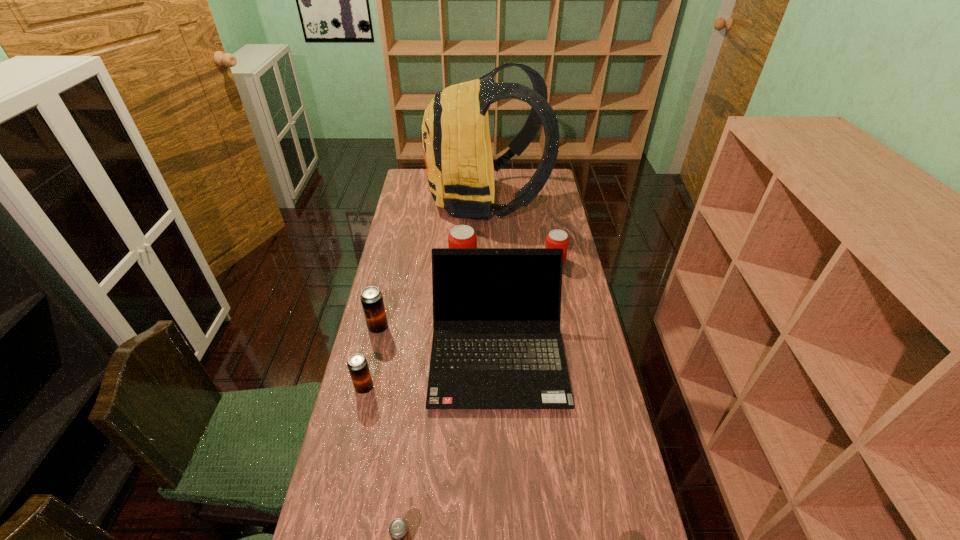
Identify the location of backpack situated at the left edge. (460, 168).

Where is `backpack that is at the right edge`? backpack that is at the right edge is located at coordinates (460, 168).

Identify the location of laptop computer that is positioned at the right edge. (497, 344).

Locate an element on the screen. beer can positioned at the right edge is located at coordinates (x=556, y=238).

The image size is (960, 540). Identify the location of object present at the far left corner. (460, 168).

Where is `object located at the far right corner`? This screenshot has height=540, width=960. object located at the far right corner is located at coordinates (460, 168).

Identify the location of vacant position at the left edge of the desktop. (380, 406).

I want to click on vacant space at the right edge, so click(x=540, y=194).

Locate an element on the screen. This screenshot has height=540, width=960. empty space that is in between the smaller red beer can and the backpack is located at coordinates (x=520, y=231).

Where is `unoccupied area between the fourth farthest beer can and the fourth beer can from left to right`? This screenshot has width=960, height=540. unoccupied area between the fourth farthest beer can and the fourth beer can from left to right is located at coordinates (414, 327).